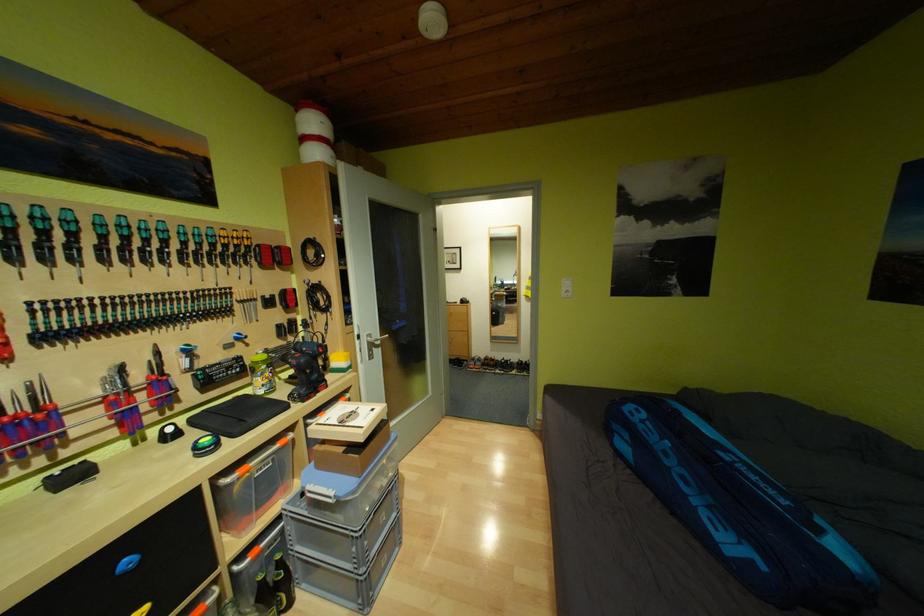
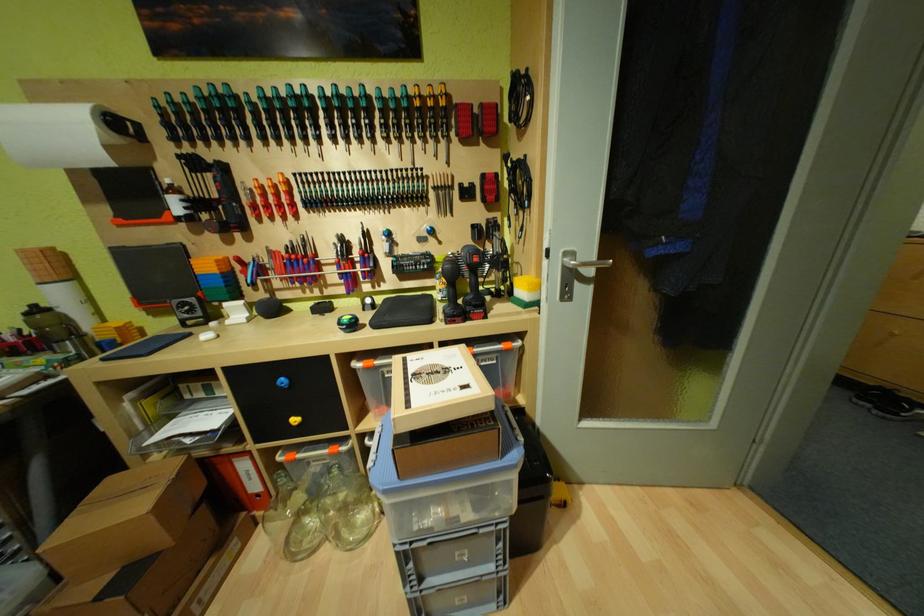
Based on the continuous images, in which direction is the camera rotating?

The rotation direction of the camera is left-down.